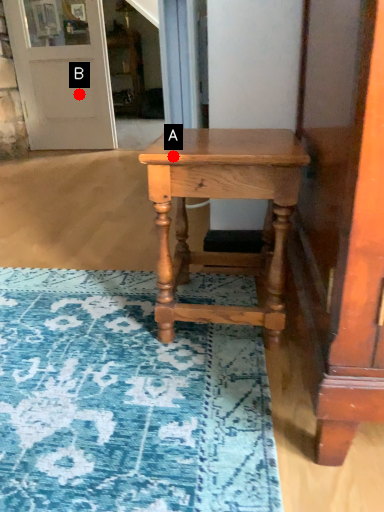
Question: Two points are circled on the image, labeled by A and B beside each circle. Which point is farther to the camera?

Choices:
 (A) A is further
 (B) B is further

Answer: (B)